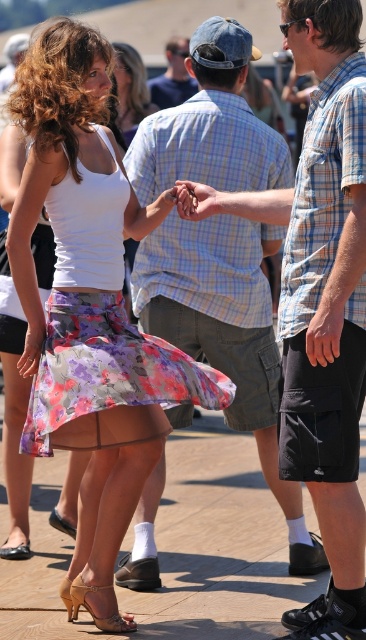
Question: Is blonde hair at center above denim cap at center?

Choices:
 (A) no
 (B) yes

Answer: (A)

Question: Does blonde hair at center appear on the left side of denim cap at center?

Choices:
 (A) no
 (B) yes

Answer: (B)

Question: Among these objects, which one is nearest to the camera?

Choices:
 (A) matte skin hand at center
 (B) denim cap at center
 (C) light blue plaid shirt at center
 (D) blonde hair at center

Answer: (A)

Question: Estimate the real-world distances between objects in this image. Which object is closer to the denim cap at center?

Choices:
 (A) matte skin hand at center
 (B) blonde hair at center
 (C) light blue plaid shirt at center

Answer: (B)

Question: Based on their relative distances, which object is farther from the denim cap at center?

Choices:
 (A) blonde hair at center
 (B) light blue plaid shirt at center

Answer: (B)

Question: From the image, what is the correct spatial relationship of floral cotton skirt at center in relation to blonde hair at center?

Choices:
 (A) above
 (B) below

Answer: (B)